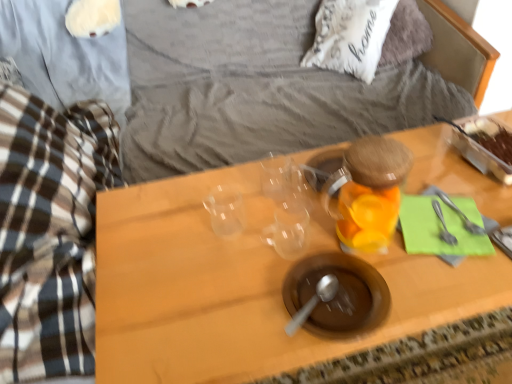
The image size is (512, 384). I want to click on vacant region to the left of silver metallic fork at right, which is the second silverware in right-to-left order, so click(x=365, y=247).